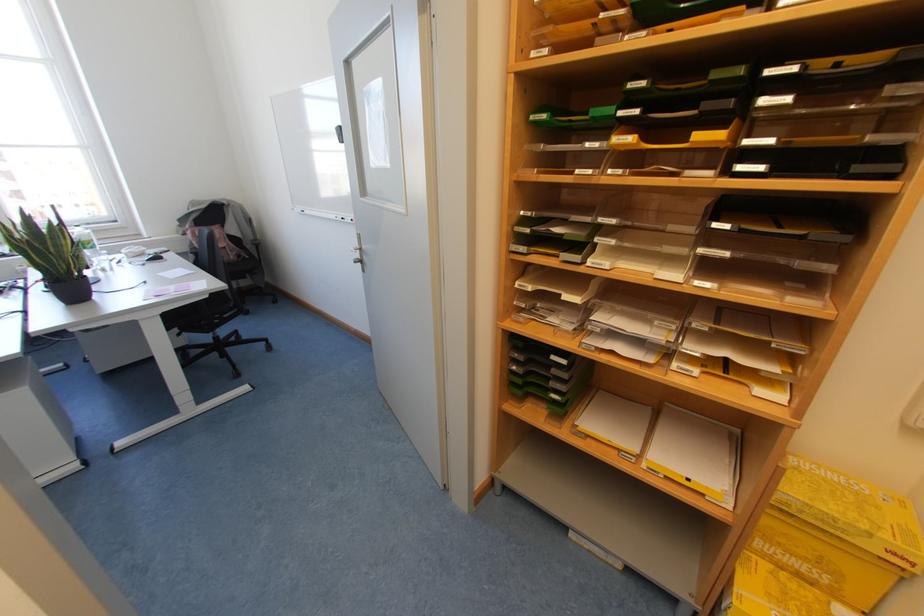
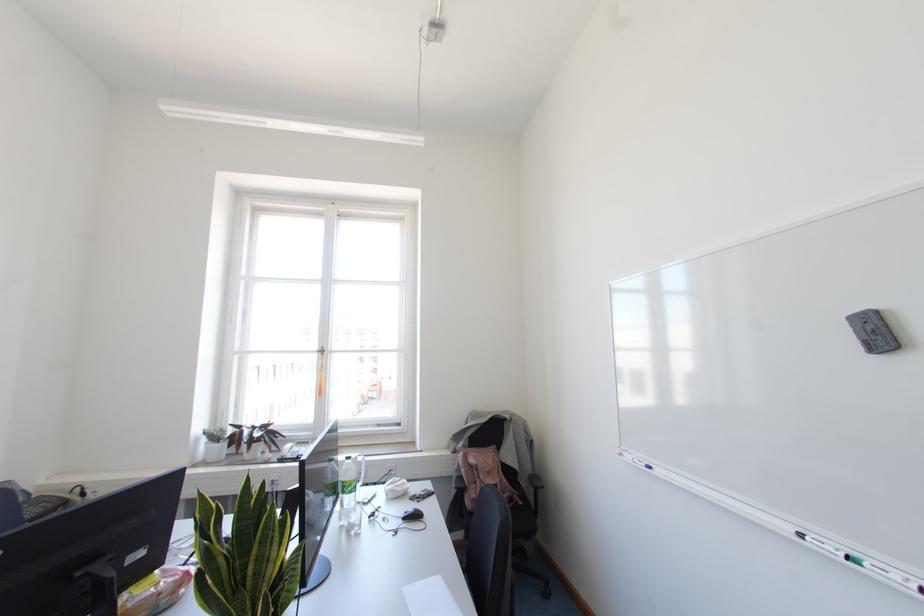
Find the pixel in the second image that matches point (156, 257) in the first image.

(415, 516)